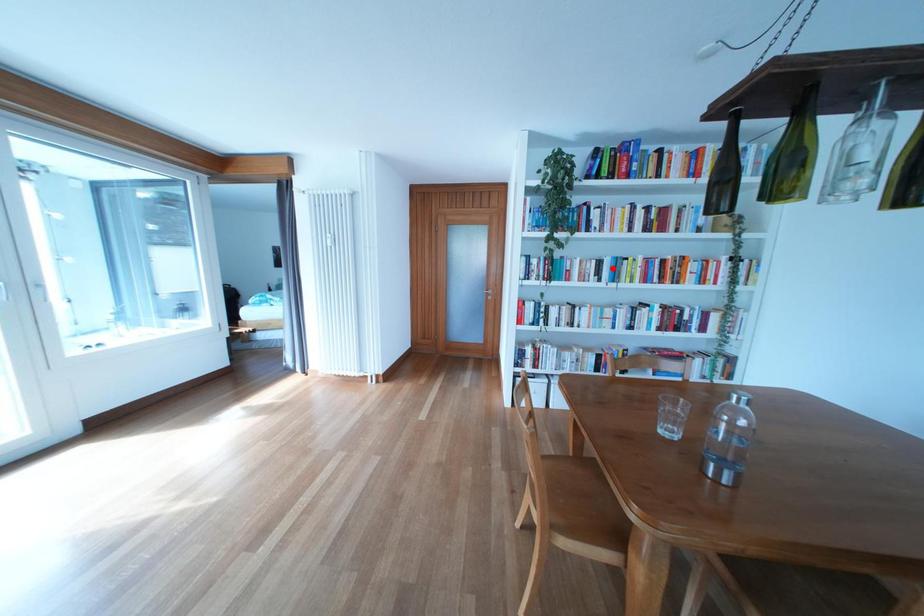
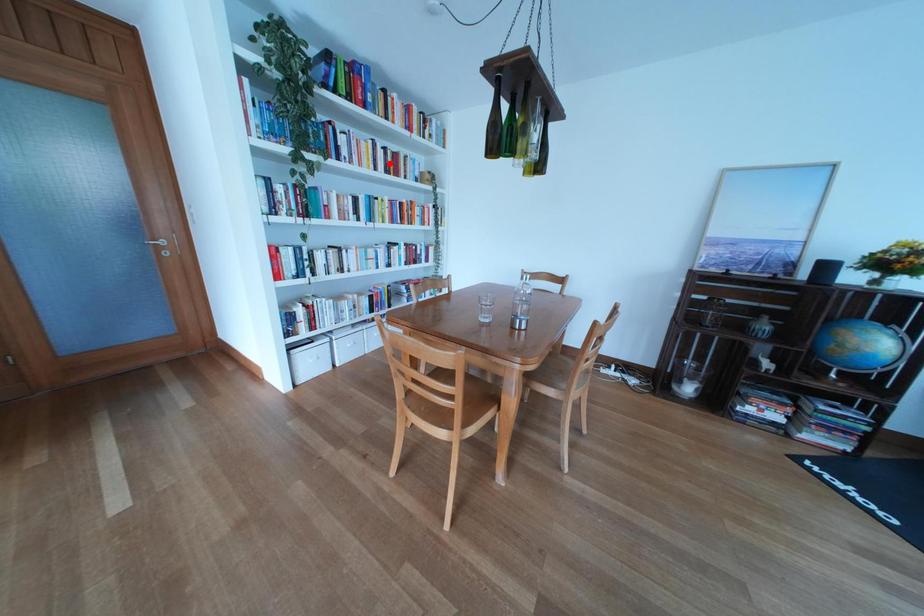
I am providing you with two images of the same scene from different viewpoints. A red point is marked on the first image and another point is marked on the second image. Is the marked point in image1 the same physical position as the marked point in image2?

No